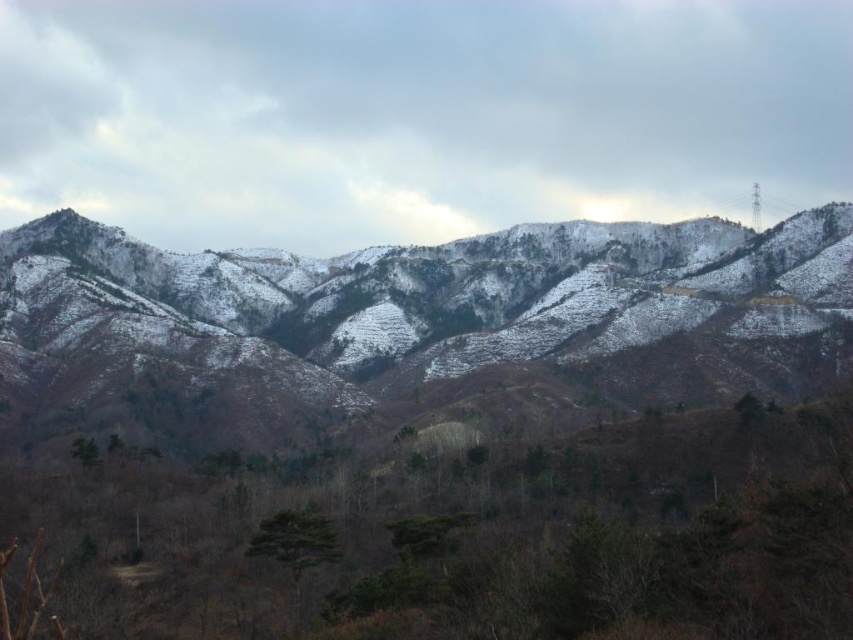
Question: Observing the image, what is the correct spatial positioning of brown matte tree at lower center in reference to snowy brown mountains at center?

Choices:
 (A) below
 (B) above

Answer: (A)

Question: Estimate the real-world distances between objects in this image. Which object is closer to the brown matte tree at lower center?

Choices:
 (A) green matte tree at center
 (B) green matte tree at lower left
 (C) snowy brown mountains at center

Answer: (A)

Question: Can you confirm if brown matte tree at lower center is positioned to the left of snowy brown mountains at center?

Choices:
 (A) no
 (B) yes

Answer: (B)

Question: Which of the following is the closest to the observer?

Choices:
 (A) brown matte tree at lower center
 (B) snowy brown mountains at center

Answer: (A)

Question: Does brown matte tree at lower center lie behind green matte tree at lower left?

Choices:
 (A) yes
 (B) no

Answer: (B)

Question: Which object appears farthest from the camera in this image?

Choices:
 (A) brown matte tree at lower center
 (B) snowy brown mountains at center

Answer: (B)